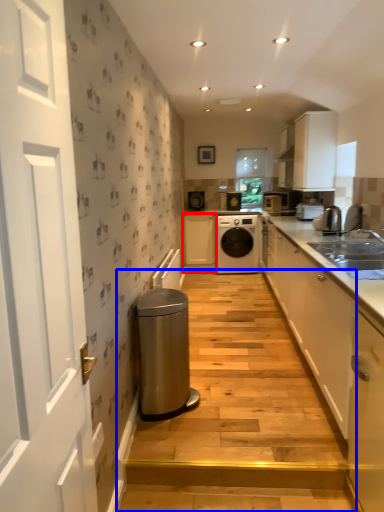
Question: Among these objects, which one is nearest to the camera, cabinetry (highlighted by a red box) or stairwell (highlighted by a blue box)?

Choices:
 (A) cabinetry
 (B) stairwell

Answer: (B)